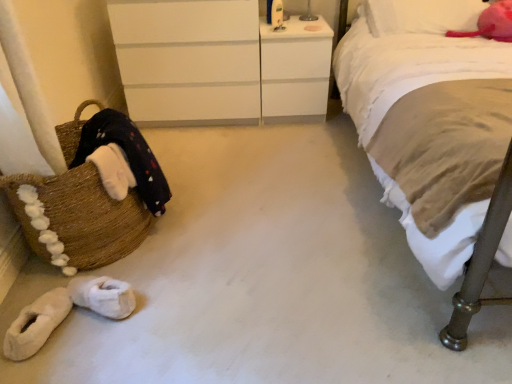
The image size is (512, 384). What are the coordinates of `free space that is in between white fluffy slippers at lower left, placed as the 2th footwear when sorted from left to right, and white fluffy slippers at lower left, the first footwear from the left` in the screenshot? It's located at (76, 341).